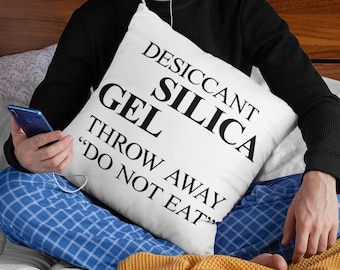
Identify the location of white pillow. Image resolution: width=340 pixels, height=270 pixels. (213, 68).